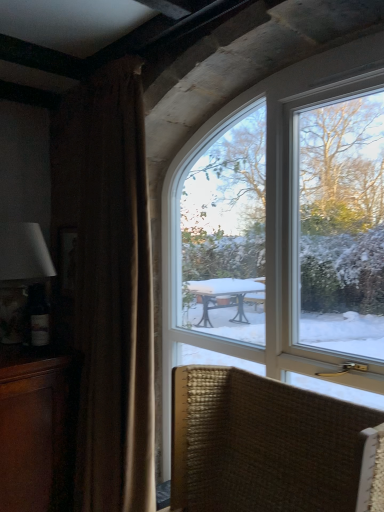
Question: Could you tell me if clear glass window at upper center is facing woven fabric chair at lower right?

Choices:
 (A) yes
 (B) no

Answer: (A)

Question: From the image's perspective, does clear glass window at upper center appear lower than woven fabric chair at lower right?

Choices:
 (A) yes
 (B) no

Answer: (B)

Question: Is the depth of clear glass window at upper center less than that of woven fabric chair at lower right?

Choices:
 (A) no
 (B) yes

Answer: (A)

Question: From a real-world perspective, does clear glass window at upper center stand above woven fabric chair at lower right?

Choices:
 (A) yes
 (B) no

Answer: (A)

Question: Considering the relative sizes of clear glass window at upper center and woven fabric chair at lower right in the image provided, is clear glass window at upper center thinner than woven fabric chair at lower right?

Choices:
 (A) no
 (B) yes

Answer: (B)

Question: From the image's perspective, would you say clear glass window at upper center is positioned over woven fabric chair at lower right?

Choices:
 (A) yes
 (B) no

Answer: (A)

Question: Considering the relative positions of brown velvet curtain at left and clear glass window at upper center in the image provided, is brown velvet curtain at left in front of clear glass window at upper center?

Choices:
 (A) yes
 (B) no

Answer: (B)

Question: Is there a large distance between brown velvet curtain at left and clear glass window at upper center?

Choices:
 (A) yes
 (B) no

Answer: (B)

Question: Is brown velvet curtain at left facing towards clear glass window at upper center?

Choices:
 (A) no
 (B) yes

Answer: (A)

Question: Can you confirm if brown velvet curtain at left is shorter than clear glass window at upper center?

Choices:
 (A) no
 (B) yes

Answer: (A)

Question: From a real-world perspective, is brown velvet curtain at left located beneath clear glass window at upper center?

Choices:
 (A) yes
 (B) no

Answer: (A)

Question: Is clear glass window at upper center located within brown velvet curtain at left?

Choices:
 (A) no
 (B) yes

Answer: (A)

Question: Is the depth of woven fabric chair at lower right less than that of matte white lampshade at left?

Choices:
 (A) yes
 (B) no

Answer: (A)